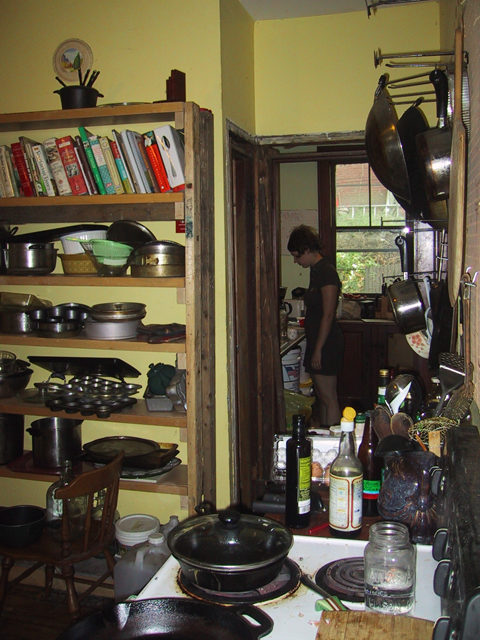
The width and height of the screenshot is (480, 640). I want to click on chair, so click(x=58, y=552).